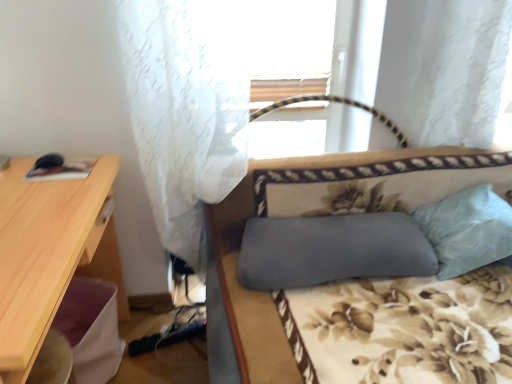
Question: Considering the relative sizes of light blue fabric pillow at right, the second pillow positioned from the left, and gray fabric studio couch at center in the image provided, is light blue fabric pillow at right, the second pillow positioned from the left, shorter than gray fabric studio couch at center?

Choices:
 (A) no
 (B) yes

Answer: (B)

Question: Is gray fabric studio couch at center completely or partially inside light blue fabric pillow at right, which appears as the first pillow when viewed from the right?

Choices:
 (A) no
 (B) yes

Answer: (A)

Question: Is light blue fabric pillow at right, which appears as the first pillow when viewed from the right, touching gray fabric studio couch at center?

Choices:
 (A) no
 (B) yes

Answer: (A)

Question: Is light blue fabric pillow at right, which appears as the first pillow when viewed from the right, completely or partially outside of gray fabric studio couch at center?

Choices:
 (A) yes
 (B) no

Answer: (B)

Question: From the image's perspective, is light blue fabric pillow at right, the second pillow positioned from the left, located beneath gray fabric studio couch at center?

Choices:
 (A) no
 (B) yes

Answer: (A)

Question: From a real-world perspective, is gray fabric pillow at center, which appears as the second pillow when viewed from the right, physically located above or below gray fabric studio couch at center?

Choices:
 (A) above
 (B) below

Answer: (A)

Question: From the image's perspective, is gray fabric pillow at center, which is the 1th pillow from left to right, located above or below gray fabric studio couch at center?

Choices:
 (A) above
 (B) below

Answer: (A)

Question: In terms of width, does gray fabric pillow at center, which is the 1th pillow from left to right, look wider or thinner when compared to gray fabric studio couch at center?

Choices:
 (A) wide
 (B) thin

Answer: (B)

Question: Considering the positions of gray fabric pillow at center, which is the 1th pillow from left to right, and gray fabric studio couch at center in the image, is gray fabric pillow at center, which is the 1th pillow from left to right, taller or shorter than gray fabric studio couch at center?

Choices:
 (A) tall
 (B) short

Answer: (B)

Question: Which is correct: light blue fabric pillow at right, which appears as the first pillow when viewed from the right, is inside gray fabric pillow at center, which appears as the second pillow when viewed from the right, or outside of it?

Choices:
 (A) inside
 (B) outside

Answer: (B)

Question: Is point (461, 266) positioned closer to the camera than point (368, 251)?

Choices:
 (A) farther
 (B) closer

Answer: (A)

Question: Based on their positions, is light blue fabric pillow at right, the second pillow positioned from the left, located to the left or right of gray fabric pillow at center, which is the 1th pillow from left to right?

Choices:
 (A) left
 (B) right

Answer: (B)

Question: From their relative heights in the image, would you say light blue fabric pillow at right, which appears as the first pillow when viewed from the right, is taller or shorter than gray fabric pillow at center, which is the 1th pillow from left to right?

Choices:
 (A) short
 (B) tall

Answer: (B)

Question: From the image's perspective, is white sheer curtain at upper left above or below light wood desk at left?

Choices:
 (A) above
 (B) below

Answer: (A)

Question: Do you think white sheer curtain at upper left is within light wood desk at left, or outside of it?

Choices:
 (A) inside
 (B) outside

Answer: (B)